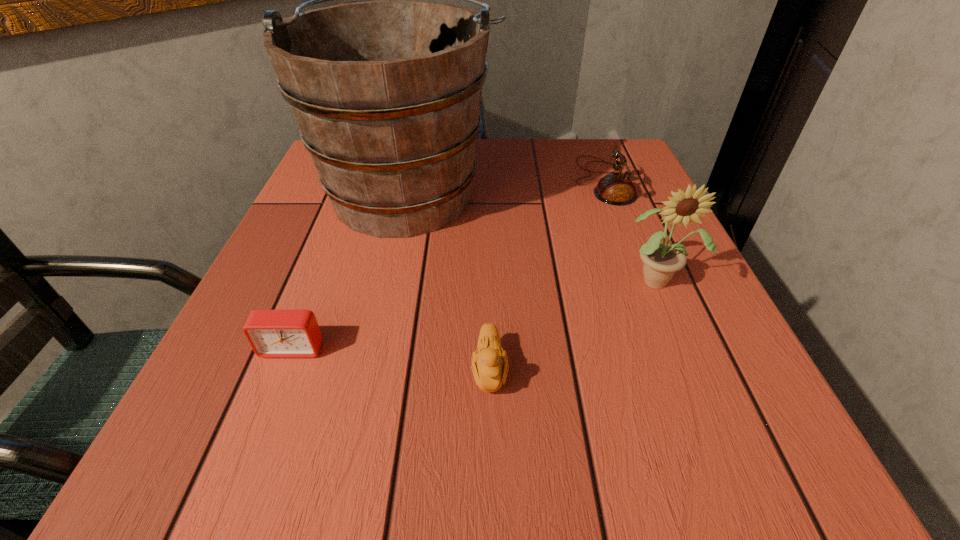
Identify the location of bucket. This screenshot has height=540, width=960. (386, 94).

This screenshot has height=540, width=960. I want to click on sunflower, so click(661, 260).

Image resolution: width=960 pixels, height=540 pixels. Identify the location of the second tallest object. (661, 260).

Locate an element on the screen. This screenshot has height=540, width=960. telephone is located at coordinates (616, 188).

Where is `duckling`? duckling is located at coordinates (490, 366).

You are a GUI agent. You are given a task and a screenshot of the screen. Output one action in this format:
    pyautogui.click(x=<x>, y=<y>)
    Task: Click on the alarm clock
    Image resolution: width=960 pixels, height=540 pixels.
    Given the screenshot: What is the action you would take?
    pyautogui.click(x=271, y=333)

This screenshot has width=960, height=540. What are the coordinates of `free space located 0.200m on the front-facing side of the third nearest object` in the screenshot? It's located at (713, 409).

You are a GUI agent. You are given a task and a screenshot of the screen. Output one action in this format:
    pyautogui.click(x=<x>, y=<y>)
    Task: Click on the vacant area located 0.390m on the rotary dial of the telephone
    
    Given the screenshot: What is the action you would take?
    pyautogui.click(x=402, y=181)

In order to click on blank space located 0.190m on the rotary dial of the telephone in this screenshot , I will do `click(491, 181)`.

This screenshot has width=960, height=540. In order to click on vacant space situated on the rotary dial of the telephone in this screenshot , I will do `click(495, 181)`.